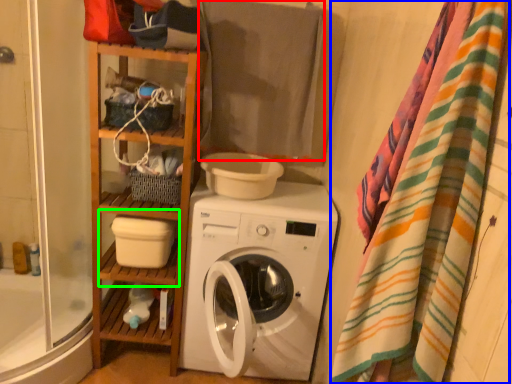
Question: Which is nearer to the beach towel (highlighted by a red box)? blanket (highlighted by a blue box) or shelf (highlighted by a green box).

Choices:
 (A) blanket
 (B) shelf

Answer: (B)